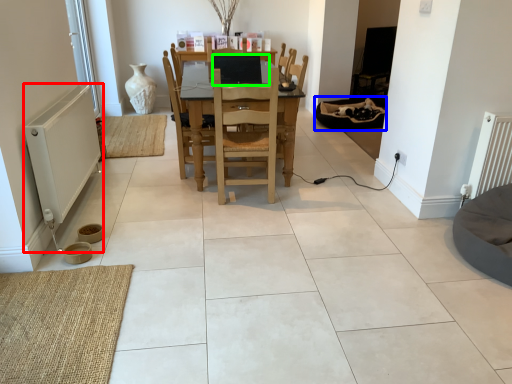
Question: Which is nearer to the appliance (highlighted by a red box)? bean bag chair (highlighted by a blue box) or computer (highlighted by a green box).

Choices:
 (A) bean bag chair
 (B) computer

Answer: (B)